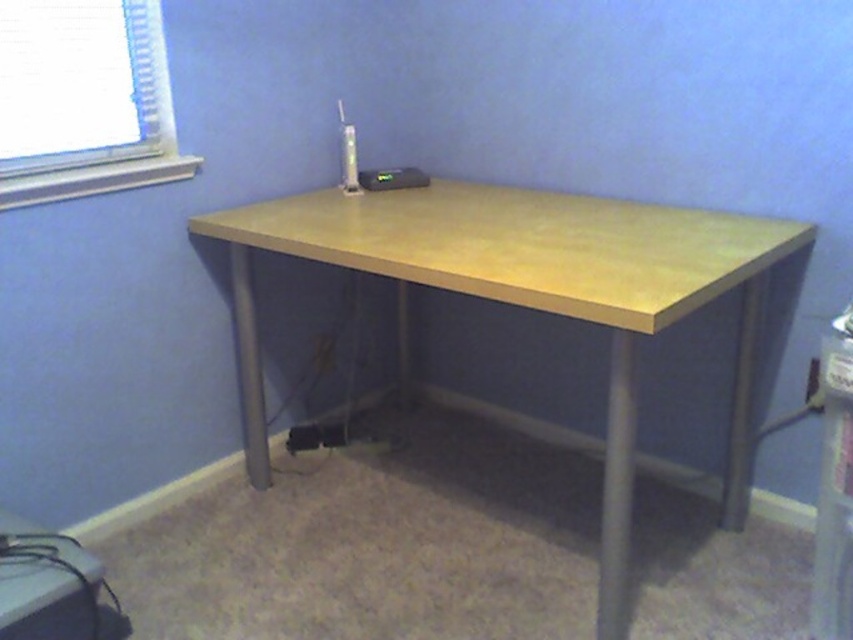
Question: Which point is farther from the camera taking this photo?

Choices:
 (A) (74, 627)
 (B) (676, 209)

Answer: (B)

Question: Is light wood/matte finish computer desk at center above black plastic computer at lower left?

Choices:
 (A) yes
 (B) no

Answer: (A)

Question: Is light wood/matte finish computer desk at center bigger than black plastic computer at lower left?

Choices:
 (A) yes
 (B) no

Answer: (A)

Question: Which object is closer to the camera taking this photo?

Choices:
 (A) black plastic computer at lower left
 (B) light wood/matte finish computer desk at center

Answer: (B)

Question: Among these points, which one is farthest from the camera?

Choices:
 (A) (610, 602)
 (B) (55, 580)

Answer: (A)

Question: Is light wood/matte finish computer desk at center smaller than black plastic computer at lower left?

Choices:
 (A) yes
 (B) no

Answer: (B)